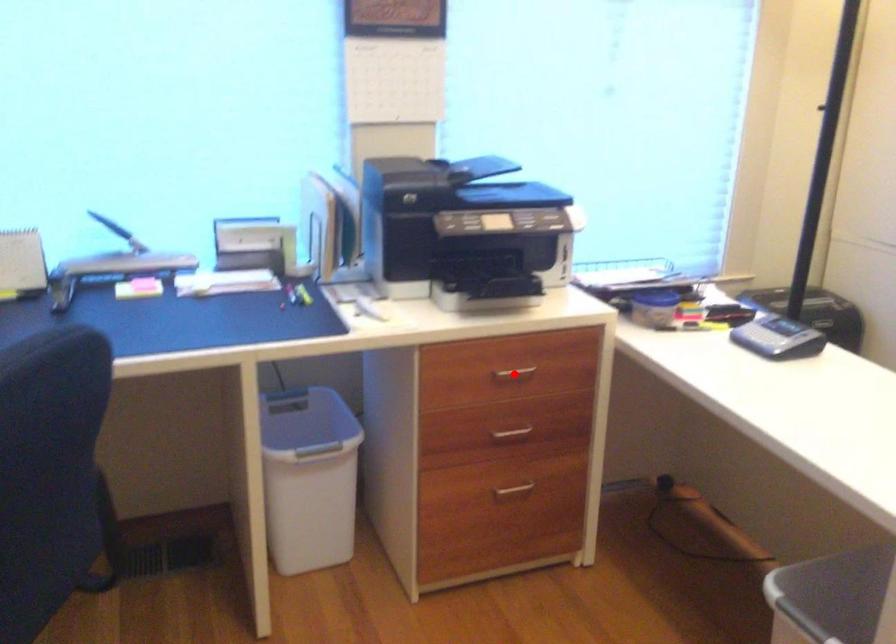
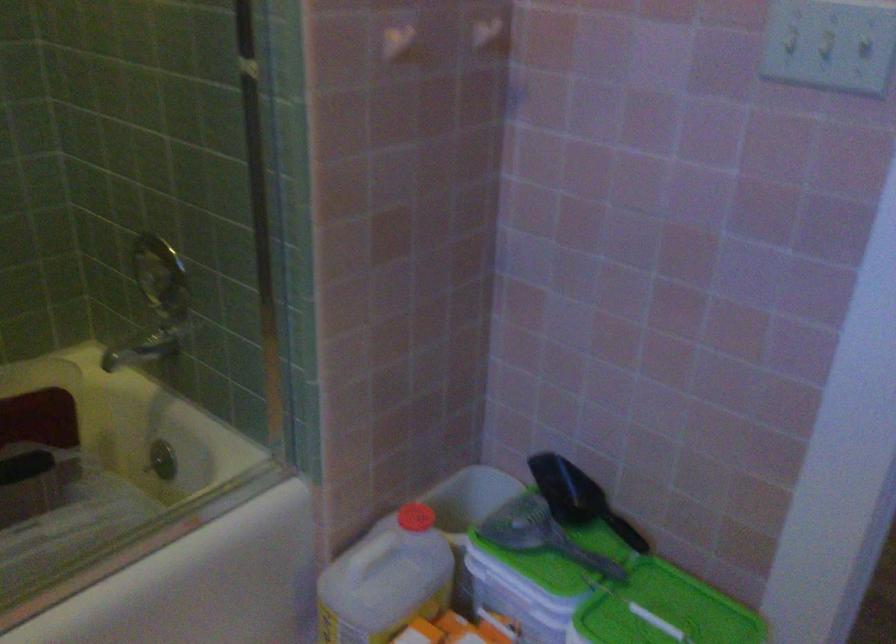
Question: I am providing you with two images of the same scene from different viewpoints. A red point is marked on the first image. Is the red point's position out of view in image 2?

Choices:
 (A) Yes
 (B) No

Answer: (A)